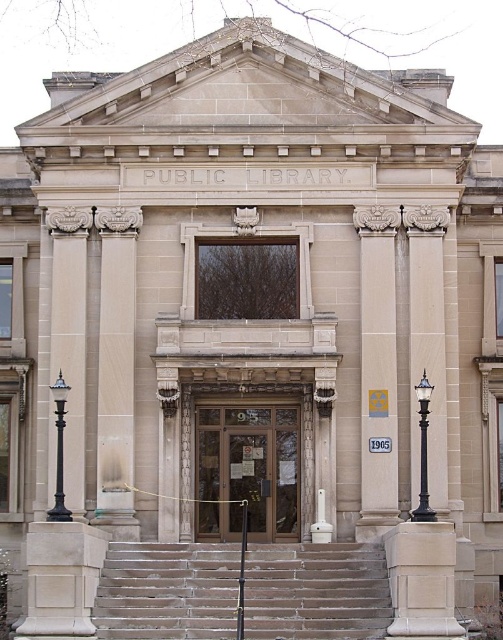
Is wooden door at center below sanded wood pillar at center?

Yes, wooden door at center is below sanded wood pillar at center.

Where is `wooden door at center`? wooden door at center is located at coordinates point(246,472).

Is stone steps at center to the left of wooden door at center from the viewer's perspective?

Incorrect, stone steps at center is not on the left side of wooden door at center.

Between stone steps at center and wooden door at center, which one appears on the right side from the viewer's perspective?

stone steps at center

Is point (270, 552) farther from viewer compared to point (280, 442)?

No, (270, 552) is closer to viewer.

Find the location of a particular element. This screenshot has width=503, height=640. stone steps at center is located at coordinates (315, 592).

Who is shorter, beige stone column at center or black polished metal lamp post at left?

black polished metal lamp post at left is shorter.

Who is higher up, beige stone column at center or black polished metal lamp post at left?

beige stone column at center

The height and width of the screenshot is (640, 503). I want to click on beige stone column at center, so click(x=377, y=369).